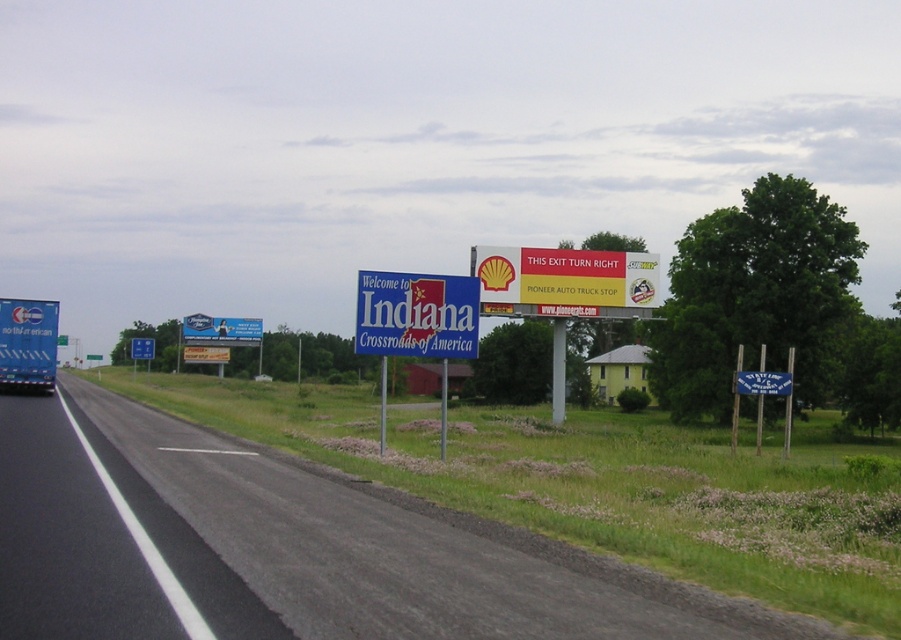
Between point (217, 598) and point (393, 316), which one is positioned in front?

Point (217, 598) is more forward.

Is point (411, 524) less distant than point (389, 276)?

Yes, point (411, 524) is closer to viewer.

The height and width of the screenshot is (640, 901). I want to click on black asphalt road at center, so click(287, 548).

Identify the location of black asphalt road at center. The image size is (901, 640). [287, 548].